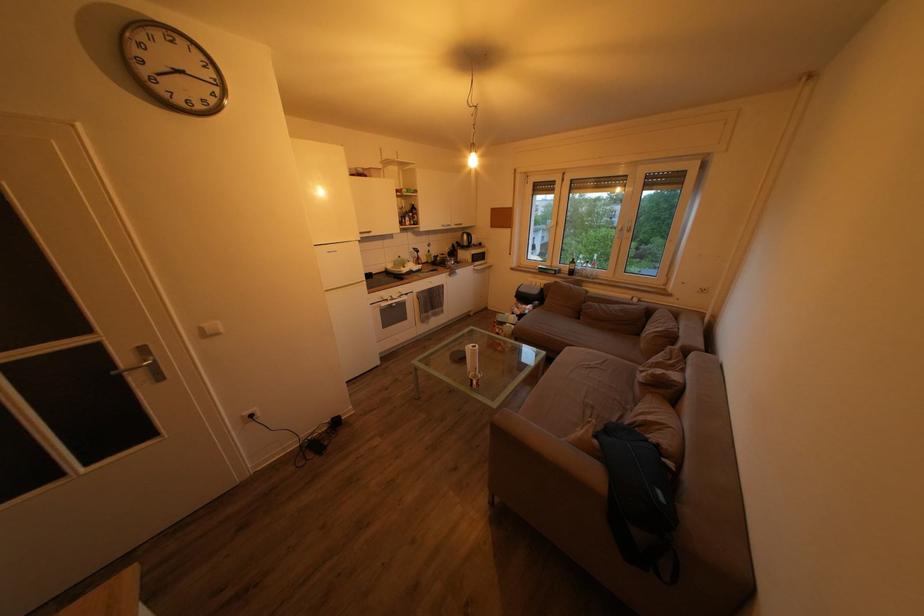
Where would you pull the paper towel roll? Please return your answer as a coordinate pair (x, y).

(471, 359)